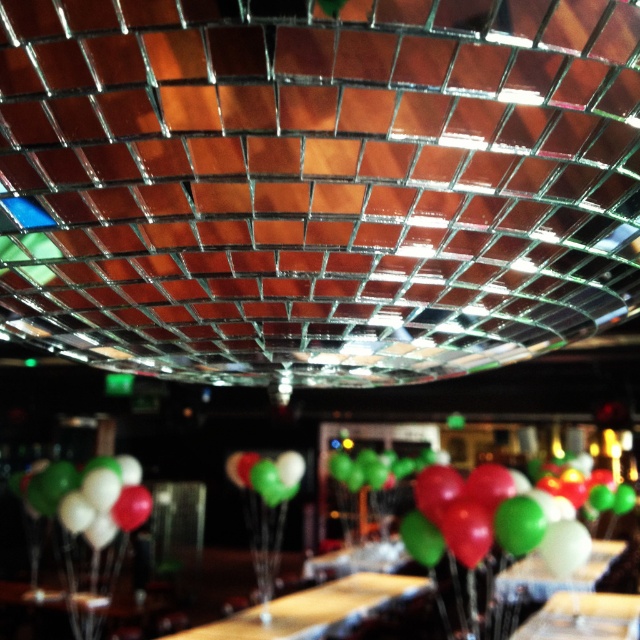
Question: Is wooden table at center behind green matte balloon at center?

Choices:
 (A) yes
 (B) no

Answer: (B)

Question: Is wooden table at center in front of green glossy balloon at lower center?

Choices:
 (A) yes
 (B) no

Answer: (A)

Question: Which of the following is the closest to the observer?

Choices:
 (A) [x=285, y=476]
 (B) [x=97, y=541]

Answer: (B)

Question: Which point is farther from the camera taking this photo?

Choices:
 (A) (45, 468)
 (B) (292, 595)
 (C) (260, 458)

Answer: (C)

Question: Does wooden table at center have a smaller size compared to green matte balloon at center?

Choices:
 (A) yes
 (B) no

Answer: (B)

Question: Which of these objects is positioned closest to the wooden table at center?

Choices:
 (A) green matte balloon at center
 (B) green glossy balloon at lower center

Answer: (A)